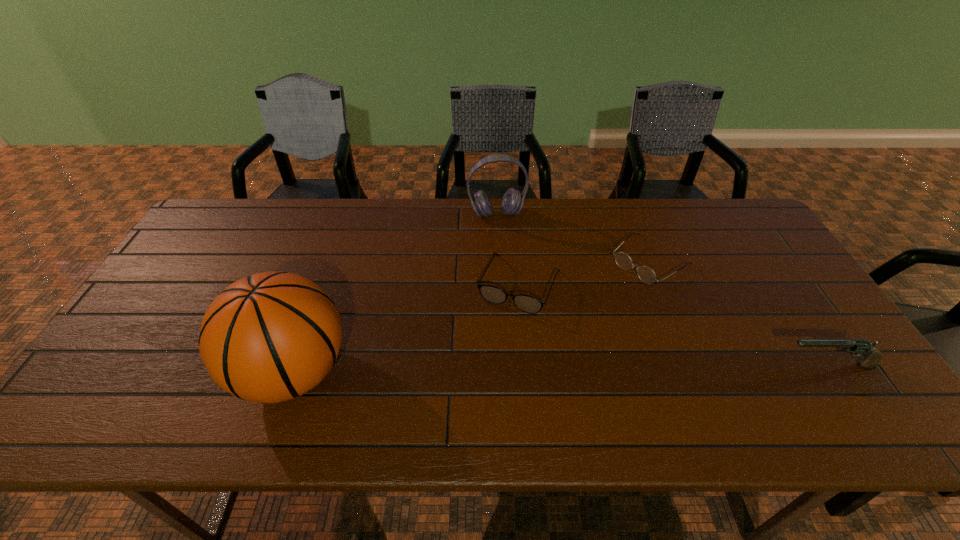
Image resolution: width=960 pixels, height=540 pixels. What are the coordinates of `free location located on the front-facing side of the left spectacles` in the screenshot? It's located at pos(472,394).

Identify the location of free location located 0.130m on the front-facing side of the left spectacles. The width and height of the screenshot is (960, 540). (490, 354).

You are a GUI agent. You are given a task and a screenshot of the screen. Output one action in this format:
    pyautogui.click(x=<x>, y=<y>)
    Task: Click on the spectacles at the far edge
    The image size is (960, 540).
    Given the screenshot: What is the action you would take?
    pyautogui.click(x=646, y=274)

Where is `headset positioned at the far edge`? headset positioned at the far edge is located at coordinates click(x=512, y=202).

Locate an element on the screen. basketball that is at the near edge is located at coordinates (270, 337).

The height and width of the screenshot is (540, 960). Identify the location of gun that is at the near edge. (860, 347).

Locate an element on the screen. object that is at the right edge is located at coordinates click(860, 347).

The width and height of the screenshot is (960, 540). In order to click on object located in the near right corner section of the desktop in this screenshot , I will do `click(860, 347)`.

Locate an element on the screen. vacant space at the far edge of the desktop is located at coordinates (678, 207).

Where is `vacant area at the near edge of the desktop`? This screenshot has width=960, height=540. vacant area at the near edge of the desktop is located at coordinates (673, 365).